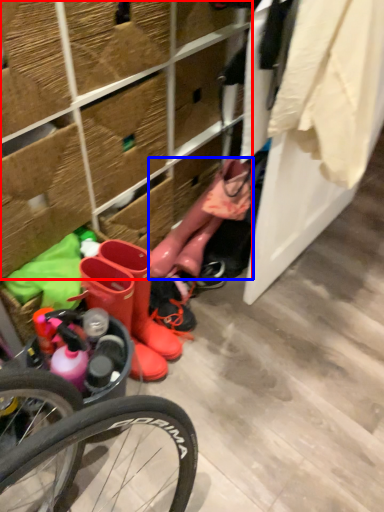
Question: Which of the following is the farthest to the observer, shelf (highlighted by a red box) or boot (highlighted by a blue box)?

Choices:
 (A) shelf
 (B) boot

Answer: (B)